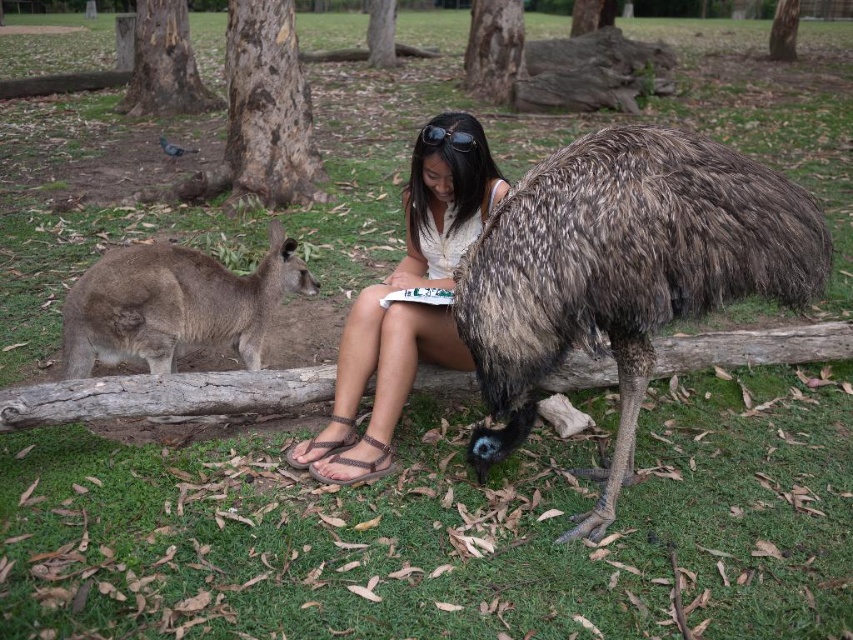
Can you confirm if brown speckled feathers at center is positioned below brown textured sandal at lower center?

Incorrect, brown speckled feathers at center is not positioned below brown textured sandal at lower center.

How far apart are brown speckled feathers at center and brown textured sandal at lower center?

They are 3.55 feet apart.

Who is more distant from viewer, (618, 484) or (357, 460)?

Point (357, 460)

In order to click on brown speckled feathers at center in this screenshot , I will do `click(622, 269)`.

Can you confirm if brown leather sandal at lower center is shorter than gray feathered pigeon at upper left?

Yes.

The width and height of the screenshot is (853, 640). What do you see at coordinates (335, 440) in the screenshot?
I see `brown leather sandal at lower center` at bounding box center [335, 440].

Find the location of a particular element. brown leather sandal at lower center is located at coordinates coord(335,440).

Who is higher up, brown furry kangaroo at left or gray feathered pigeon at upper left?

Positioned higher is gray feathered pigeon at upper left.

Who is taller, brown furry kangaroo at left or gray feathered pigeon at upper left?

With more height is brown furry kangaroo at left.

Does point (119, 342) lie behind point (169, 150)?

That is False.

Image resolution: width=853 pixels, height=640 pixels. In order to click on brown furry kangaroo at left in this screenshot , I will do `click(173, 305)`.